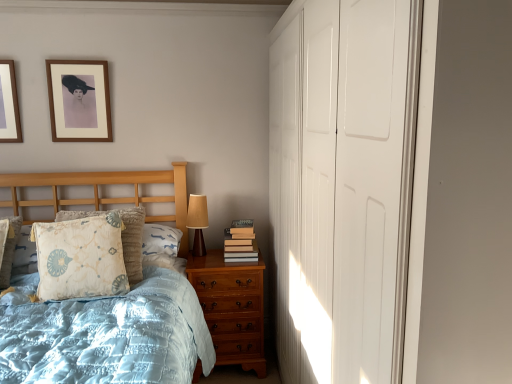
Question: Would you say matte brown wood table lamp at right is to the left or to the right of floral-patterned fabric pillow at left in the picture?

Choices:
 (A) left
 (B) right

Answer: (B)

Question: From a real-world perspective, is matte brown wood table lamp at right above or below floral-patterned fabric pillow at left?

Choices:
 (A) above
 (B) below

Answer: (A)

Question: Considering the real-world distances, which object is farthest from the hardcover books at right?

Choices:
 (A) floral-patterned fabric pillow at left
 (B) light brown wood chest of drawers at lower right
 (C) matte wood picture frame at upper left, which is counted as the second picture frame, starting from the right
 (D) wooden picture frame at upper left, the first picture frame from the right
 (E) matte brown wood table lamp at right

Answer: (C)

Question: Which is nearer to the light blue quilted bed at left?

Choices:
 (A) hardcover books at right
 (B) matte wood picture frame at upper left, which is counted as the second picture frame, starting from the right
 (C) floral-patterned fabric pillow at left
 (D) wooden picture frame at upper left, the first picture frame from the right
 (E) white glossy closet doors at right

Answer: (D)